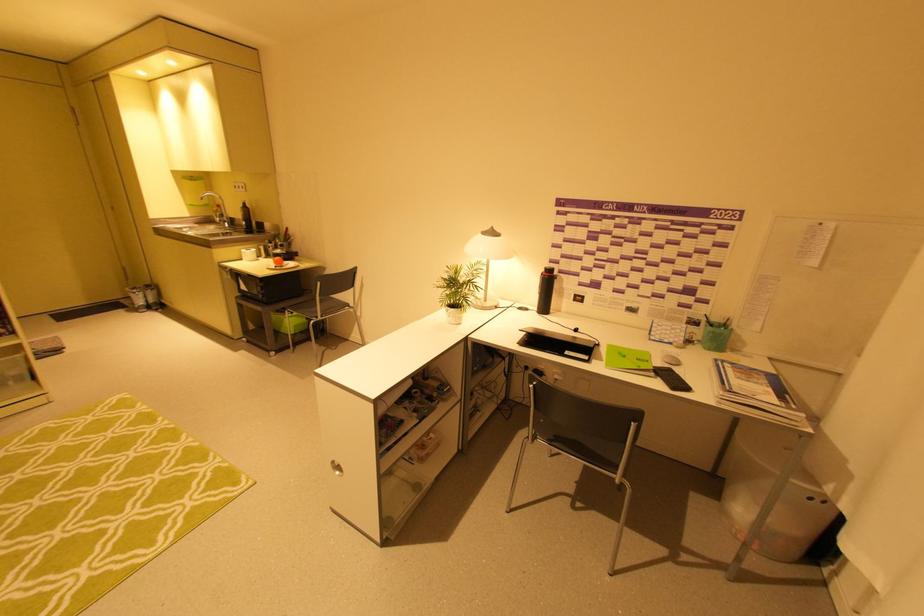
Image resolution: width=924 pixels, height=616 pixels. What do you see at coordinates (217, 217) in the screenshot? I see `the sink faucet handle` at bounding box center [217, 217].